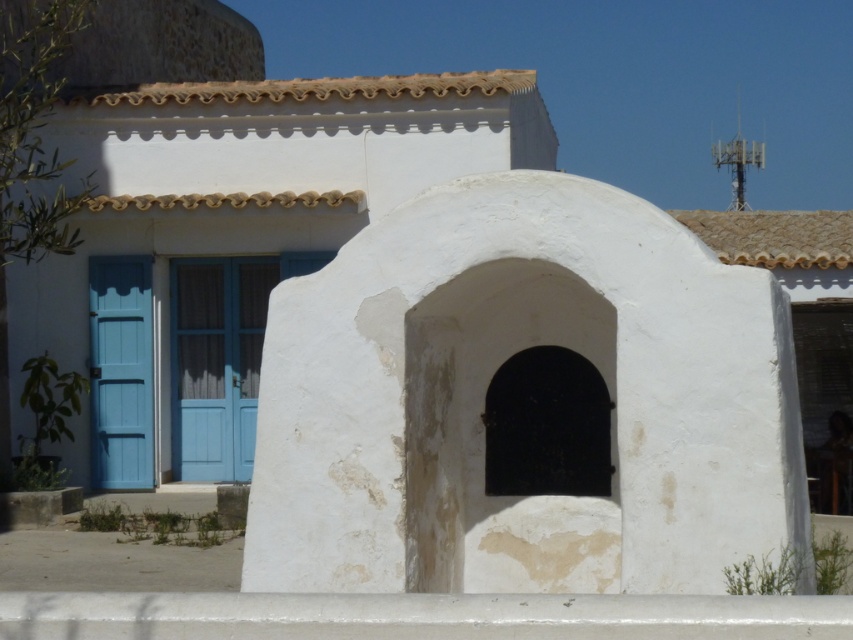
You are a painter hired to paint the building. You need to decide the order of painting tasks. Which object should you paint first, the white rough stone archway at center or the blue painted wood door at left, based on their positions?

The white rough stone archway at center is above the blue painted wood door at left, so you should paint the white rough stone archway at center first to avoid dripping paint onto the door below.